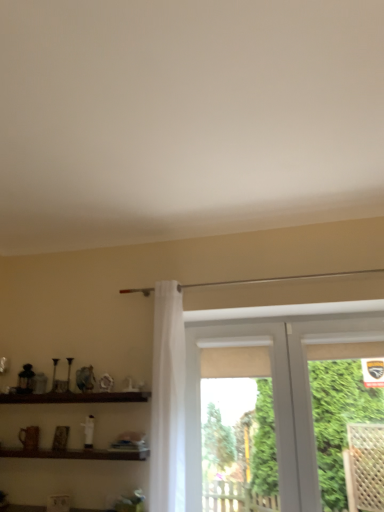
Identify the location of brown wooden shelf at lower left, positioned as the second shelf in bottom-to-top order. (75, 397).

This screenshot has width=384, height=512. Identify the location of green leafy plant at right. (338, 420).

Can you confirm if white plastic window at center is positioned to the left of brown wooden shelf at lower left, positioned as the second shelf in bottom-to-top order?

No.

Is point (310, 343) positioned after point (9, 395)?

No, (310, 343) is in front of (9, 395).

In terms of width, does white plastic window at center look wider or thinner when compared to brown wooden shelf at lower left, positioned as the second shelf in bottom-to-top order?

In the image, white plastic window at center appears to be more narrow than brown wooden shelf at lower left, positioned as the second shelf in bottom-to-top order.

Is point (287, 465) positioned behind point (364, 387)?

No, (287, 465) is closer to viewer.

Is white plastic window at center positioned far away from green leafy plant at right?

white plastic window at center is near green leafy plant at right, not far away.

From the image's perspective, is white plastic window at center positioned above or below green leafy plant at right?

white plastic window at center is below green leafy plant at right.

How different are the orientations of white plastic window at center and green leafy plant at right in degrees?

They differ by 90 degrees in their facing directions.

Considering the sizes of white plastic window at center and brown wooden shelf at lower left, the second shelf from the top, in the image, is white plastic window at center bigger or smaller than brown wooden shelf at lower left, the second shelf from the top,?

Clearly, white plastic window at center is larger in size than brown wooden shelf at lower left, the second shelf from the top.

From a real-world perspective, who is located lower, white plastic window at center or brown wooden shelf at lower left, the second shelf from the top?

brown wooden shelf at lower left, the second shelf from the top, is physically lower.

Considering the sizes of white plastic window at center and brown wooden shelf at lower left, the second shelf from the top, in the image, is white plastic window at center taller or shorter than brown wooden shelf at lower left, the second shelf from the top,?

In the image, white plastic window at center appears to be taller than brown wooden shelf at lower left, the second shelf from the top.

Does point (13, 454) come closer to viewer compared to point (324, 492)?

That is False.

Is brown wooden shelf at lower left, positioned as the 1th shelf in bottom-to-top order, aimed at green leafy plant at right?

No, brown wooden shelf at lower left, positioned as the 1th shelf in bottom-to-top order, is not oriented towards green leafy plant at right.

Is brown wooden shelf at lower left, positioned as the second shelf in bottom-to-top order, outside of brown wooden shelf at lower left, positioned as the 1th shelf in bottom-to-top order?

brown wooden shelf at lower left, positioned as the second shelf in bottom-to-top order, lies outside brown wooden shelf at lower left, positioned as the 1th shelf in bottom-to-top order,'s area.

From a real-world perspective, is brown wooden shelf at lower left, placed as the first shelf when sorted from top to bottom, on brown wooden shelf at lower left, positioned as the 1th shelf in bottom-to-top order?

Yes, from a real-world perspective, brown wooden shelf at lower left, placed as the first shelf when sorted from top to bottom, is on top of brown wooden shelf at lower left, positioned as the 1th shelf in bottom-to-top order.

Between brown wooden shelf at lower left, placed as the first shelf when sorted from top to bottom, and brown wooden shelf at lower left, positioned as the 1th shelf in bottom-to-top order, which one is positioned in front?

brown wooden shelf at lower left, positioned as the 1th shelf in bottom-to-top order, is more forward.

Is the depth of brown wooden shelf at lower left, the second shelf from the top, greater than that of brown wooden shelf at lower left, positioned as the second shelf in bottom-to-top order?

No, it is in front of brown wooden shelf at lower left, positioned as the second shelf in bottom-to-top order.

Would you say brown wooden shelf at lower left, positioned as the 1th shelf in bottom-to-top order, is inside or outside brown wooden shelf at lower left, positioned as the second shelf in bottom-to-top order?

The correct answer is: outside.

Is brown wooden shelf at lower left, the second shelf from the top, aimed at brown wooden shelf at lower left, positioned as the second shelf in bottom-to-top order?

No, brown wooden shelf at lower left, the second shelf from the top, does not turn towards brown wooden shelf at lower left, positioned as the second shelf in bottom-to-top order.

Is brown wooden shelf at lower left, positioned as the second shelf in bottom-to-top order, aimed at green leafy plant at right?

No, brown wooden shelf at lower left, positioned as the second shelf in bottom-to-top order, is not facing towards green leafy plant at right.

Does brown wooden shelf at lower left, positioned as the second shelf in bottom-to-top order, have a greater height compared to green leafy plant at right?

Incorrect, the height of brown wooden shelf at lower left, positioned as the second shelf in bottom-to-top order, is not larger of that of green leafy plant at right.

From the image's perspective, relative to green leafy plant at right, is brown wooden shelf at lower left, positioned as the second shelf in bottom-to-top order, above or below?

brown wooden shelf at lower left, positioned as the second shelf in bottom-to-top order, is situated higher than green leafy plant at right in the image.

Considering the relative sizes of brown wooden shelf at lower left, placed as the first shelf when sorted from top to bottom, and green leafy plant at right in the image provided, is brown wooden shelf at lower left, placed as the first shelf when sorted from top to bottom, bigger than green leafy plant at right?

Actually, brown wooden shelf at lower left, placed as the first shelf when sorted from top to bottom, might be smaller than green leafy plant at right.

You are a GUI agent. You are given a task and a screenshot of the screen. Output one action in this format:
    pyautogui.click(x=<x>, y=<y>)
    Task: Click on the shelf above the white plastic window at center (from the image's perspective)
    This screenshot has width=384, height=512.
    Given the screenshot: What is the action you would take?
    pyautogui.click(x=75, y=397)

Locate an element on the screen. This screenshot has height=512, width=384. window that is on the left side of green leafy plant at right is located at coordinates (277, 390).

Which object lies nearer to the anchor point white plastic window at center, green leafy plant at right or brown wooden shelf at lower left, positioned as the 1th shelf in bottom-to-top order?

green leafy plant at right is positioned closer to the anchor white plastic window at center.

Which object lies further to the anchor point green leafy plant at right, white plastic window at center or brown wooden shelf at lower left, positioned as the second shelf in bottom-to-top order?

Based on the image, brown wooden shelf at lower left, positioned as the second shelf in bottom-to-top order, appears to be further to green leafy plant at right.

When comparing their distances from green leafy plant at right, does brown wooden shelf at lower left, placed as the first shelf when sorted from top to bottom, or brown wooden shelf at lower left, the second shelf from the top, seem closer?

Based on the image, brown wooden shelf at lower left, the second shelf from the top, appears to be nearer to green leafy plant at right.

Considering their positions, is brown wooden shelf at lower left, positioned as the 1th shelf in bottom-to-top order, positioned further to brown wooden shelf at lower left, positioned as the second shelf in bottom-to-top order, than green leafy plant at right?

green leafy plant at right is further to brown wooden shelf at lower left, positioned as the second shelf in bottom-to-top order.

Looking at this image, when comparing their distances from brown wooden shelf at lower left, positioned as the 1th shelf in bottom-to-top order, does green leafy plant at right or brown wooden shelf at lower left, positioned as the second shelf in bottom-to-top order, seem closer?

brown wooden shelf at lower left, positioned as the second shelf in bottom-to-top order, is closer to brown wooden shelf at lower left, positioned as the 1th shelf in bottom-to-top order.

Looking at the image, which one is located further to brown wooden shelf at lower left, positioned as the second shelf in bottom-to-top order, white plastic window at center or green leafy plant at right?

green leafy plant at right lies further to brown wooden shelf at lower left, positioned as the second shelf in bottom-to-top order, than the other object.

From the image, which object appears to be nearer to brown wooden shelf at lower left, positioned as the second shelf in bottom-to-top order, green leafy plant at right or brown wooden shelf at lower left, the second shelf from the top?

The object closer to brown wooden shelf at lower left, positioned as the second shelf in bottom-to-top order, is brown wooden shelf at lower left, the second shelf from the top.

When comparing their distances from white plastic window at center, does green leafy plant at right or brown wooden shelf at lower left, placed as the first shelf when sorted from top to bottom, seem further?

brown wooden shelf at lower left, placed as the first shelf when sorted from top to bottom, is positioned further to the anchor white plastic window at center.

The height and width of the screenshot is (512, 384). In order to click on shelf between brown wooden shelf at lower left, positioned as the second shelf in bottom-to-top order, and white plastic window at center from left to right in this screenshot , I will do `click(76, 454)`.

Identify the location of shelf between brown wooden shelf at lower left, positioned as the second shelf in bottom-to-top order, and green leafy plant at right. This screenshot has height=512, width=384. (76, 454).

At what (x,y) coordinates should I click in order to perform the action: click on window between brown wooden shelf at lower left, positioned as the 1th shelf in bottom-to-top order, and green leafy plant at right. Please return your answer as a coordinate pair (x, y). Looking at the image, I should click on (277, 390).

Where is `window located between brown wooden shelf at lower left, placed as the first shelf when sorted from top to bottom, and green leafy plant at right in the left-right direction`? window located between brown wooden shelf at lower left, placed as the first shelf when sorted from top to bottom, and green leafy plant at right in the left-right direction is located at coordinates (277, 390).